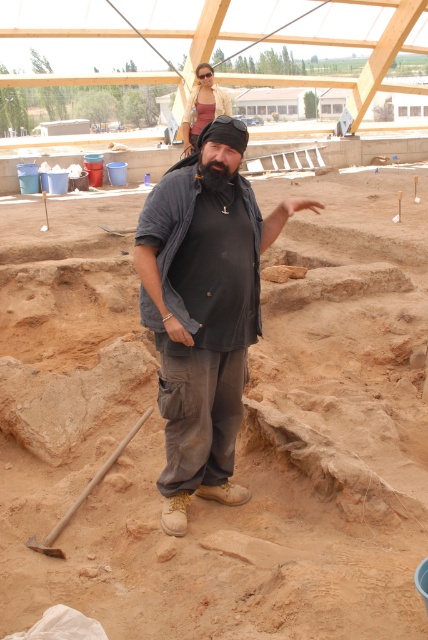
You are an archaeologist at the excavation site and need to retrieve the wooden shovel at lower left. Based on its coordinates, is it closer to the foreground worker or the background structure?

The wooden shovel at lower left is located at point (x=83, y=497), which places it closer to the foreground worker since the shovel is in the foreground area near the worker.

You are an archaeologist at the excavation site. You need to compare the sizes of the wooden shovel at lower left and the black fuzzy beard at center. Which one has a greater width?

The wooden shovel at lower left has a greater width than the black fuzzy beard at center according to the description.

You are an archaeologist at the excavation site. You need to determine which object is larger between the brown sandy soil at center and the wooden shovel at lower left. Which one is bigger?

The wooden shovel at lower left is larger than the brown sandy soil at center.